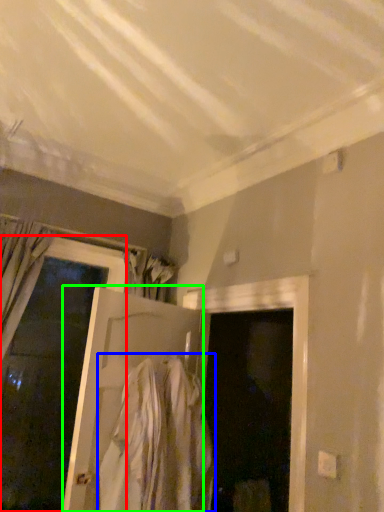
Question: Which object is the farthest from door (highlighted by a red box)? Choose among these: clothing (highlighted by a blue box) or door (highlighted by a green box).

Choices:
 (A) clothing
 (B) door

Answer: (A)